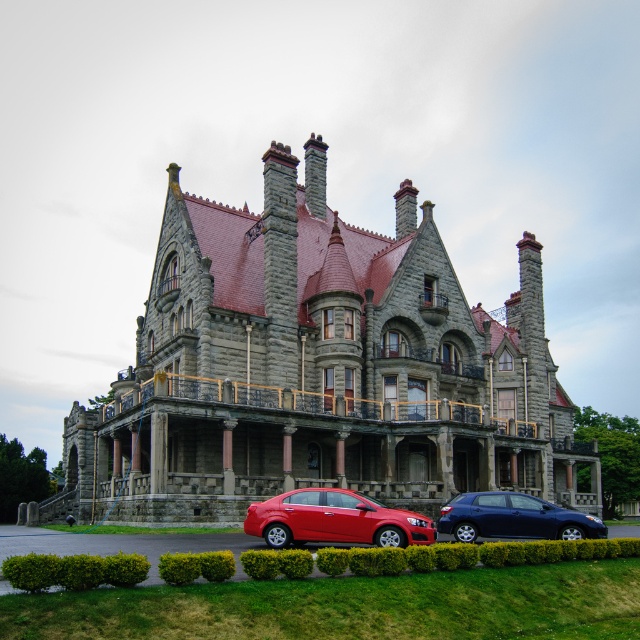
Does stone mansion at center appear on the left side of matte red sedan at center?

In fact, stone mansion at center is to the right of matte red sedan at center.

Does stone mansion at center come in front of matte red sedan at center?

No.

At what (x,y) coordinates should I click in order to perform the action: click on stone mansion at center. Please return your answer as a coordinate pair (x, y). The height and width of the screenshot is (640, 640). Looking at the image, I should click on (317, 369).

You are a GUI agent. You are given a task and a screenshot of the screen. Output one action in this format:
    pyautogui.click(x=<x>, y=<y>)
    Task: Click on the stone mansion at center
    Image resolution: width=640 pixels, height=640 pixels.
    Given the screenshot: What is the action you would take?
    pyautogui.click(x=317, y=369)

Is point (241, 412) positioned in front of point (442, 529)?

No.

Between stone mansion at center and metallic blue hatchback at lower center, which one is positioned lower?

metallic blue hatchback at lower center is below.

You are a GUI agent. You are given a task and a screenshot of the screen. Output one action in this format:
    pyautogui.click(x=<x>, y=<y>)
    Task: Click on the stone mansion at center
    
    Given the screenshot: What is the action you would take?
    pyautogui.click(x=317, y=369)

Where is `stone mansion at center`? stone mansion at center is located at coordinates (317, 369).

Between matte red sedan at center and metallic blue hatchback at lower center, which one appears on the left side from the viewer's perspective?

Positioned to the left is matte red sedan at center.

Which is behind, point (296, 524) or point (513, 534)?

Point (513, 534)

Identify the location of matte red sedan at center. (333, 518).